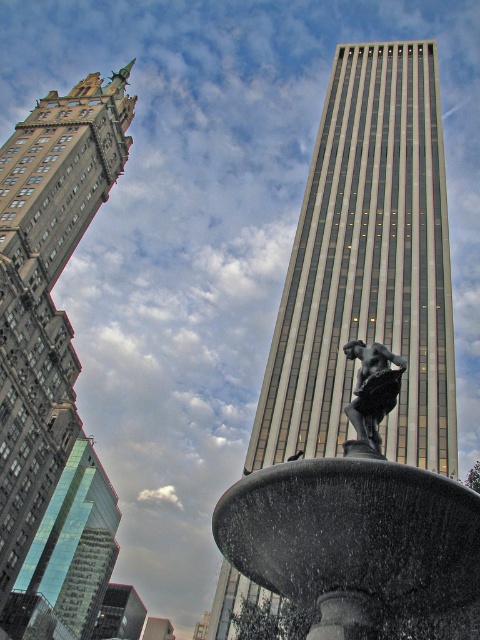
Who is lower down, gray metallic skyscraper at center or bronze statue at center?

bronze statue at center is lower down.

Does gray metallic skyscraper at center have a larger size compared to bronze statue at center?

Yes, gray metallic skyscraper at center is bigger than bronze statue at center.

This screenshot has height=640, width=480. Find the location of `gray metallic skyscraper at center`. gray metallic skyscraper at center is located at coordinates (368, 268).

Identify the location of gray metallic skyscraper at center. The height and width of the screenshot is (640, 480). (368, 268).

Is green glass skyscraper at lower left wider than bronze statue at center?

Correct, the width of green glass skyscraper at lower left exceeds that of bronze statue at center.

The width and height of the screenshot is (480, 640). Identify the location of green glass skyscraper at lower left. (68, 556).

Describe the element at coordinates (68, 556) in the screenshot. I see `green glass skyscraper at lower left` at that location.

The width and height of the screenshot is (480, 640). What are the coordinates of `green glass skyscraper at lower left` in the screenshot? It's located at (68, 556).

Who is more distant from viewer, [26,536] or [372,384]?

Point [26,536]

Is green glass building at left positioned behind bronze statue at center?

Yes, green glass building at left is behind bronze statue at center.

Is point (24, 333) closer to camera compared to point (351, 417)?

No, (24, 333) is behind (351, 417).

Image resolution: width=480 pixels, height=640 pixels. What are the coordinates of `green glass building at left` in the screenshot? It's located at (47, 289).